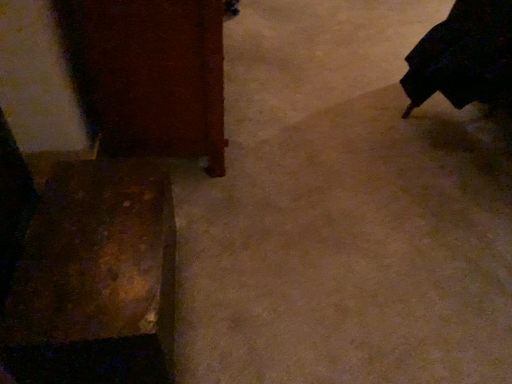
You are a GUI agent. You are given a task and a screenshot of the screen. Output one action in this format:
    pyautogui.click(x=<x>, y=<y>)
    Task: Click on the wooden cabinet at left, which is the first furniture from top to bottom
    The width and height of the screenshot is (512, 384).
    Given the screenshot: What is the action you would take?
    pyautogui.click(x=151, y=75)

This screenshot has height=384, width=512. What do you see at coordinates (95, 279) in the screenshot?
I see `rusty metal box at lower left, the first furniture when ordered from bottom to top` at bounding box center [95, 279].

Where is `black matte robe at right`? The width and height of the screenshot is (512, 384). black matte robe at right is located at coordinates (463, 56).

The height and width of the screenshot is (384, 512). In order to click on wooden cabinet at left, arranged as the 2th furniture when ordered from the bottom in this screenshot , I will do `click(151, 75)`.

Is the position of black matte robe at right more distant than that of rusty metal box at lower left, the 2th furniture from the top?

Yes, black matte robe at right is further from the viewer.

Consider the image. Who is taller, black matte robe at right or rusty metal box at lower left, the first furniture when ordered from bottom to top?

Standing taller between the two is black matte robe at right.

Would you say black matte robe at right is a long distance from rusty metal box at lower left, the 2th furniture from the top?

black matte robe at right is far away from rusty metal box at lower left, the 2th furniture from the top.

From the picture: What's the angular difference between rusty metal box at lower left, the first furniture when ordered from bottom to top, and wooden cabinet at left, arranged as the 2th furniture when ordered from the bottom,'s facing directions?

The facing directions of rusty metal box at lower left, the first furniture when ordered from bottom to top, and wooden cabinet at left, arranged as the 2th furniture when ordered from the bottom, are 0.917 degrees apart.

Does rusty metal box at lower left, the 2th furniture from the top, have a greater height compared to wooden cabinet at left, arranged as the 2th furniture when ordered from the bottom?

No, rusty metal box at lower left, the 2th furniture from the top, is not taller than wooden cabinet at left, arranged as the 2th furniture when ordered from the bottom.

From the image's perspective, is rusty metal box at lower left, the 2th furniture from the top, located beneath wooden cabinet at left, arranged as the 2th furniture when ordered from the bottom?

Correct, rusty metal box at lower left, the 2th furniture from the top, appears lower than wooden cabinet at left, arranged as the 2th furniture when ordered from the bottom, in the image.

In the scene shown: Is rusty metal box at lower left, the 2th furniture from the top, at the right side of wooden cabinet at left, which is the first furniture from top to bottom?

In fact, rusty metal box at lower left, the 2th furniture from the top, is to the left of wooden cabinet at left, which is the first furniture from top to bottom.

Is black matte robe at right with wooden cabinet at left, which is the first furniture from top to bottom?

black matte robe at right and wooden cabinet at left, which is the first furniture from top to bottom, are clearly separated.

Between point (499, 61) and point (160, 5), which one is positioned behind?

The point (499, 61) is behind.

Is black matte robe at right oriented away from wooden cabinet at left, which is the first furniture from top to bottom?

No, black matte robe at right is not facing away from wooden cabinet at left, which is the first furniture from top to bottom.

How far apart are rusty metal box at lower left, the first furniture when ordered from bottom to top, and black matte robe at right?

They are 1.27 meters apart.

Based on the photo, considering their positions, is rusty metal box at lower left, the first furniture when ordered from bottom to top, located in front of or behind black matte robe at right?

rusty metal box at lower left, the first furniture when ordered from bottom to top, is positioned closer to the viewer than black matte robe at right.

From the image's perspective, is rusty metal box at lower left, the first furniture when ordered from bottom to top, over black matte robe at right?

Incorrect, from the image's perspective, rusty metal box at lower left, the first furniture when ordered from bottom to top, is lower than black matte robe at right.

Between rusty metal box at lower left, the first furniture when ordered from bottom to top, and black matte robe at right, which one has smaller width?

rusty metal box at lower left, the first furniture when ordered from bottom to top, is thinner.

Is there a large distance between wooden cabinet at left, arranged as the 2th furniture when ordered from the bottom, and black matte robe at right?

No, wooden cabinet at left, arranged as the 2th furniture when ordered from the bottom, is not far away from black matte robe at right.

You are a GUI agent. You are given a task and a screenshot of the screen. Output one action in this format:
    pyautogui.click(x=<x>, y=<y>)
    Task: Click on the robe behind the wooden cabinet at left, arranged as the 2th furniture when ordered from the bottom
    
    Given the screenshot: What is the action you would take?
    pyautogui.click(x=463, y=56)

Considering their positions, is wooden cabinet at left, arranged as the 2th furniture when ordered from the bottom, located in front of or behind black matte robe at right?

wooden cabinet at left, arranged as the 2th furniture when ordered from the bottom, is positioned closer to the viewer than black matte robe at right.

Is wooden cabinet at left, which is the first furniture from top to bottom, outside of black matte robe at right?

Absolutely, wooden cabinet at left, which is the first furniture from top to bottom, is external to black matte robe at right.

Does wooden cabinet at left, which is the first furniture from top to bottom, appear on the right side of rusty metal box at lower left, the 2th furniture from the top?

Indeed, wooden cabinet at left, which is the first furniture from top to bottom, is positioned on the right side of rusty metal box at lower left, the 2th furniture from the top.

Relative to rusty metal box at lower left, the first furniture when ordered from bottom to top, is wooden cabinet at left, arranged as the 2th furniture when ordered from the bottom, in front or behind?

wooden cabinet at left, arranged as the 2th furniture when ordered from the bottom, is behind rusty metal box at lower left, the first furniture when ordered from bottom to top.

Considering the positions of points (166, 117) and (8, 305), is point (166, 117) closer to camera compared to point (8, 305)?

That is False.

There is a rusty metal box at lower left, the 2th furniture from the top. Where is `furniture above it (from a real-world perspective)`? The width and height of the screenshot is (512, 384). furniture above it (from a real-world perspective) is located at coordinates (151, 75).

Locate an element on the screen. The width and height of the screenshot is (512, 384). robe above the rusty metal box at lower left, the 2th furniture from the top (from the image's perspective) is located at coordinates pos(463,56).

The height and width of the screenshot is (384, 512). I want to click on furniture on the left side of wooden cabinet at left, arranged as the 2th furniture when ordered from the bottom, so click(x=95, y=279).

From the image, which object appears to be farther from rusty metal box at lower left, the 2th furniture from the top, wooden cabinet at left, arranged as the 2th furniture when ordered from the bottom, or black matte robe at right?

The object further to rusty metal box at lower left, the 2th furniture from the top, is black matte robe at right.

Estimate the real-world distances between objects in this image. Which object is closer to wooden cabinet at left, arranged as the 2th furniture when ordered from the bottom, rusty metal box at lower left, the 2th furniture from the top, or black matte robe at right?

rusty metal box at lower left, the 2th furniture from the top, lies closer to wooden cabinet at left, arranged as the 2th furniture when ordered from the bottom, than the other object.

Considering their positions, is black matte robe at right positioned further to rusty metal box at lower left, the first furniture when ordered from bottom to top, than wooden cabinet at left, which is the first furniture from top to bottom?

Based on the image, black matte robe at right appears to be further to rusty metal box at lower left, the first furniture when ordered from bottom to top.

Looking at the image, which one is located further to black matte robe at right, wooden cabinet at left, arranged as the 2th furniture when ordered from the bottom, or rusty metal box at lower left, the first furniture when ordered from bottom to top?

rusty metal box at lower left, the first furniture when ordered from bottom to top, is further to black matte robe at right.

Looking at the image, which one is located further to wooden cabinet at left, which is the first furniture from top to bottom, black matte robe at right or rusty metal box at lower left, the 2th furniture from the top?

Based on the image, black matte robe at right appears to be further to wooden cabinet at left, which is the first furniture from top to bottom.

From the image, which object appears to be farther from black matte robe at right, rusty metal box at lower left, the first furniture when ordered from bottom to top, or wooden cabinet at left, which is the first furniture from top to bottom?

rusty metal box at lower left, the first furniture when ordered from bottom to top.

Locate an element on the screen. furniture between rusty metal box at lower left, the 2th furniture from the top, and black matte robe at right is located at coordinates (151, 75).